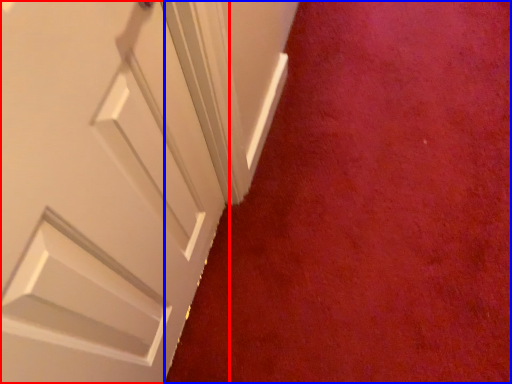
Question: Which object is further to the camera taking this photo, door (highlighted by a red box) or plain (highlighted by a blue box)?

Choices:
 (A) door
 (B) plain

Answer: (B)